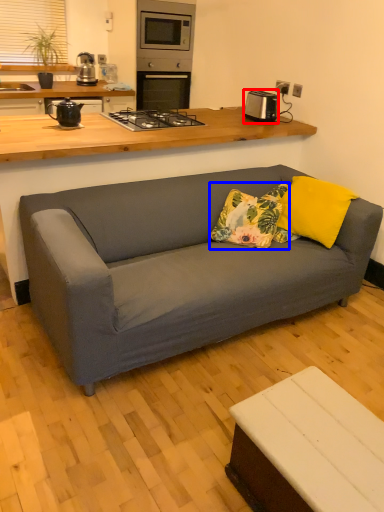
Question: Which object is closer to the camera taking this photo, appliance (highlighted by a red box) or throw pillow (highlighted by a blue box)?

Choices:
 (A) appliance
 (B) throw pillow

Answer: (B)